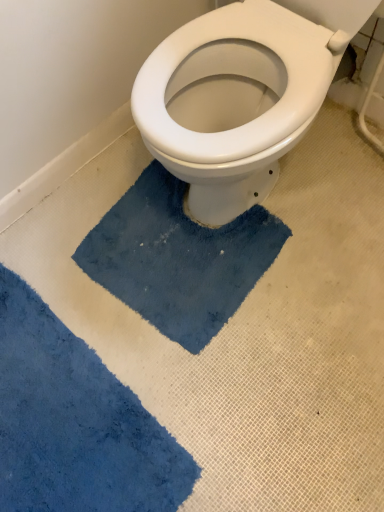
Where is `vacant area that lies to the right of blue soft rug at lower left, the second bath mat positioned from the top`? The width and height of the screenshot is (384, 512). vacant area that lies to the right of blue soft rug at lower left, the second bath mat positioned from the top is located at coordinates click(235, 348).